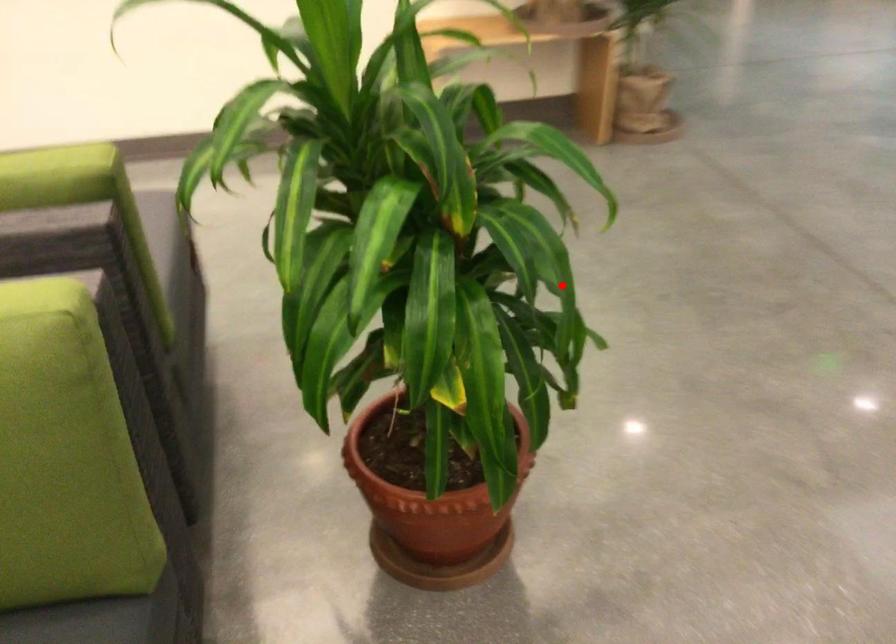
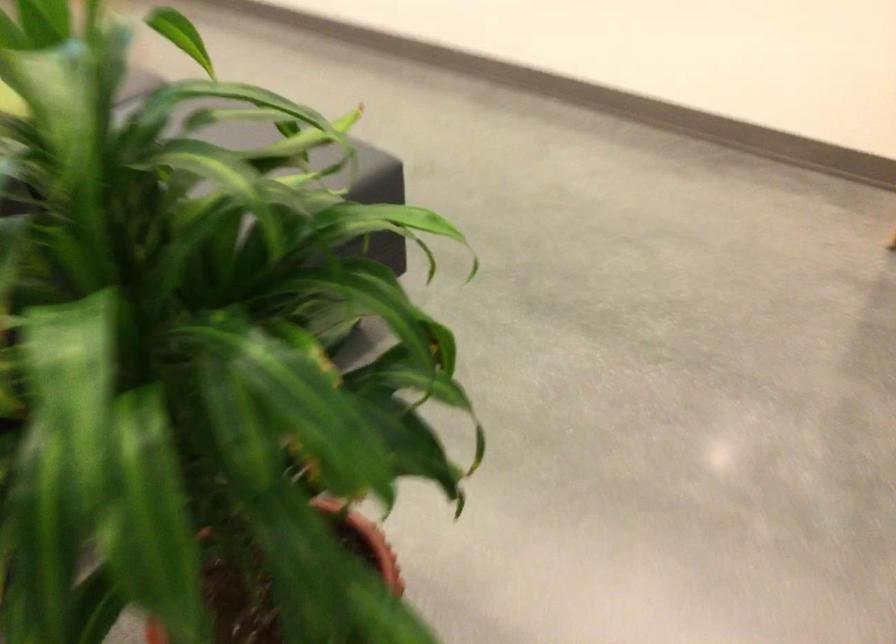
In the second image, find the point that corresponds to the highlighted location in the first image.

(325, 558)